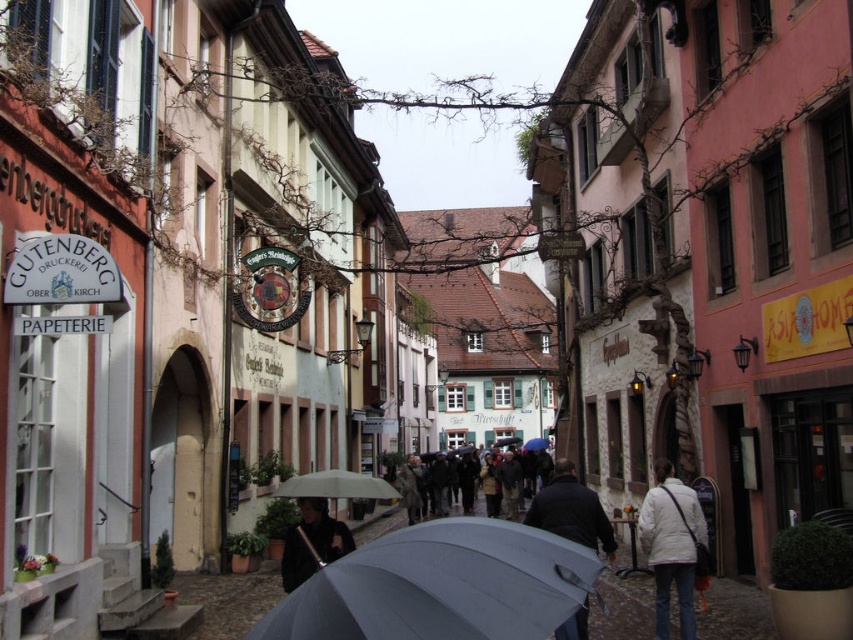
You are a delivery person standing on the narrow street and you see the dark gray fabric umbrella at center and the dark gray coat at center. Which one is higher up?

The dark gray fabric umbrella at center is above the dark gray coat at center.

You are a tourist in this European town and you see a black matte coat at center and a transparent fabric umbrella at center. Which item is closer to the shop named GUTENBERG DRUCKEREI OBER KIRCH PAPETERIE on the left side of the street?

The black matte coat at center is closer to the shop named GUTENBERG DRUCKEREI OBER KIRCH PAPETERIE on the left side of the street because it is positioned to the left of the transparent fabric umbrella at center.